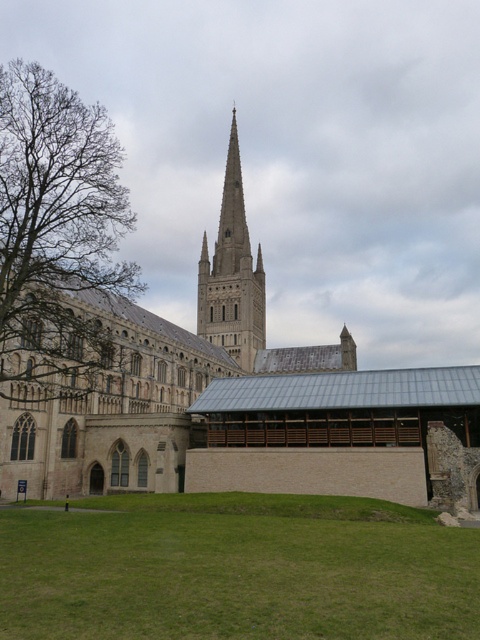
You are standing at the entrance of the historic cathedral and want to find the green grass at lower center. According to the coordinates provided, where exactly should you look to locate it?

The green grass at lower center is located at point [237,570].

You are standing in the courtyard of the historic building and want to take a photo of the stone spire at center. To ensure the green grass at lower center is visible in the frame, where should you position yourself relative to the spire?

You should position yourself to the right of the stone spire at center so that the green grass at lower center, which is to the left of the spire, will be included in the photo frame.

You are standing in the courtyard of the historic building and want to take a photo of the tall, pointed spire at the center. To avoid the brown leafy tree at left from blocking the view, where should you position yourself relative to the tree?

To avoid the brown leafy tree at left from blocking the view of the spire, position yourself to the right of the tree since it is located at point (56, 234), which is on the left side of the courtyard.